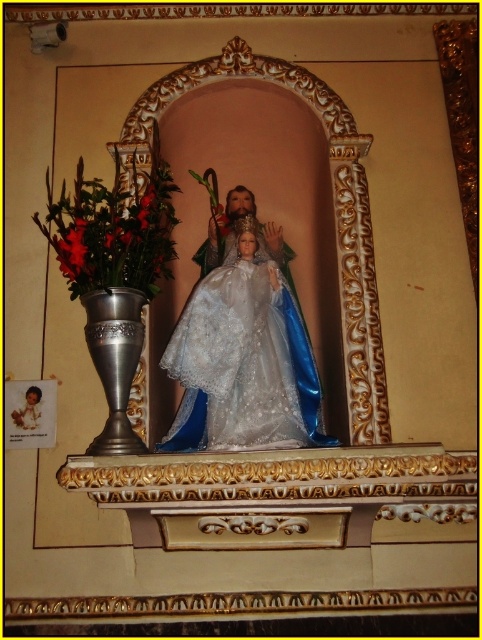
Question: Does satin white gown at center have a greater width compared to metallic vase at left?

Choices:
 (A) yes
 (B) no

Answer: (A)

Question: Is satin white gown at center smaller than metallic vase at left?

Choices:
 (A) yes
 (B) no

Answer: (B)

Question: Can you confirm if satin white gown at center is bigger than metallic vase at left?

Choices:
 (A) yes
 (B) no

Answer: (A)

Question: Which point is farther to the camera?

Choices:
 (A) (232, 419)
 (B) (168, 196)

Answer: (B)